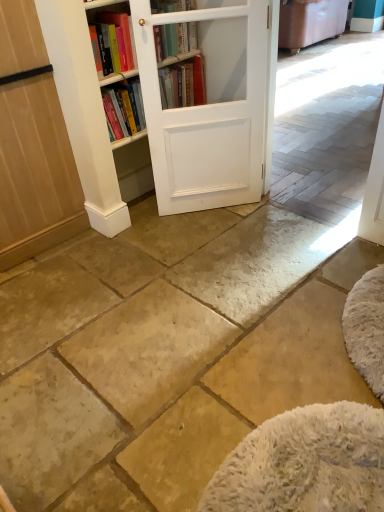
Where is `blank space to the left of white matte barn door at center`? The image size is (384, 512). blank space to the left of white matte barn door at center is located at coordinates (151, 224).